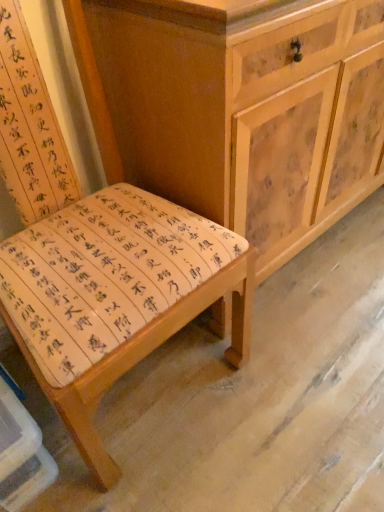
Question: From a real-world perspective, is wooden bench at center physically above wooden cabinet at center?

Choices:
 (A) yes
 (B) no

Answer: (A)

Question: Does wooden bench at center have a lesser width compared to wooden cabinet at center?

Choices:
 (A) no
 (B) yes

Answer: (A)

Question: Can you confirm if wooden bench at center is positioned to the right of wooden cabinet at center?

Choices:
 (A) no
 (B) yes

Answer: (A)

Question: Is wooden bench at center bigger than wooden cabinet at center?

Choices:
 (A) no
 (B) yes

Answer: (A)

Question: Is wooden bench at center positioned far away from wooden cabinet at center?

Choices:
 (A) no
 (B) yes

Answer: (A)

Question: Does wooden bench at center have a greater width compared to wooden cabinet at center?

Choices:
 (A) no
 (B) yes

Answer: (B)

Question: Is wooden cabinet at center smaller than wooden bench at center?

Choices:
 (A) yes
 (B) no

Answer: (B)

Question: From the image's perspective, is wooden cabinet at center below wooden bench at center?

Choices:
 (A) no
 (B) yes

Answer: (A)

Question: From a real-world perspective, is wooden cabinet at center positioned over wooden bench at center based on gravity?

Choices:
 (A) yes
 (B) no

Answer: (B)

Question: Does wooden cabinet at center come in front of wooden bench at center?

Choices:
 (A) yes
 (B) no

Answer: (B)

Question: Is wooden cabinet at center beside wooden bench at center?

Choices:
 (A) no
 (B) yes

Answer: (A)

Question: Does wooden cabinet at center have a larger size compared to wooden bench at center?

Choices:
 (A) yes
 (B) no

Answer: (A)

Question: From the image's perspective, is wooden bench at center positioned above or below wooden cabinet at center?

Choices:
 (A) below
 (B) above

Answer: (A)